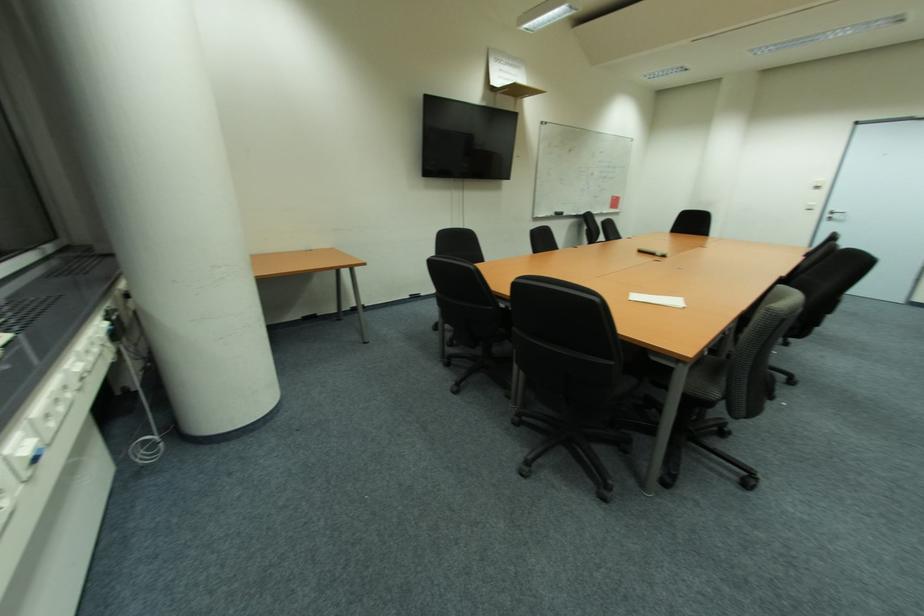
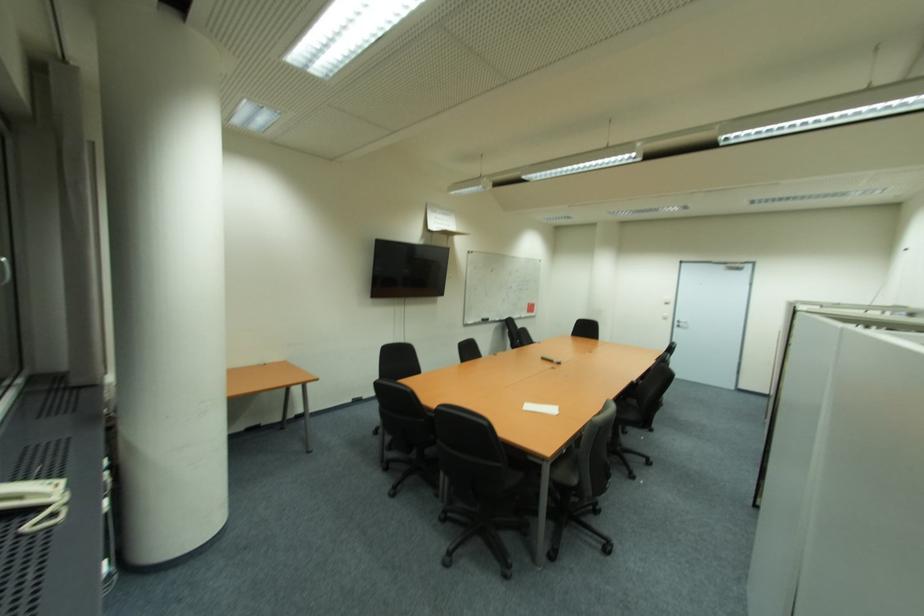
Question: Which direction would the cameraman need to move to produce the second image? Reply with the corresponding letter.

Choices:
 (A) Left
 (B) Right
 (C) Forward
 (D) Backward

Answer: (D)